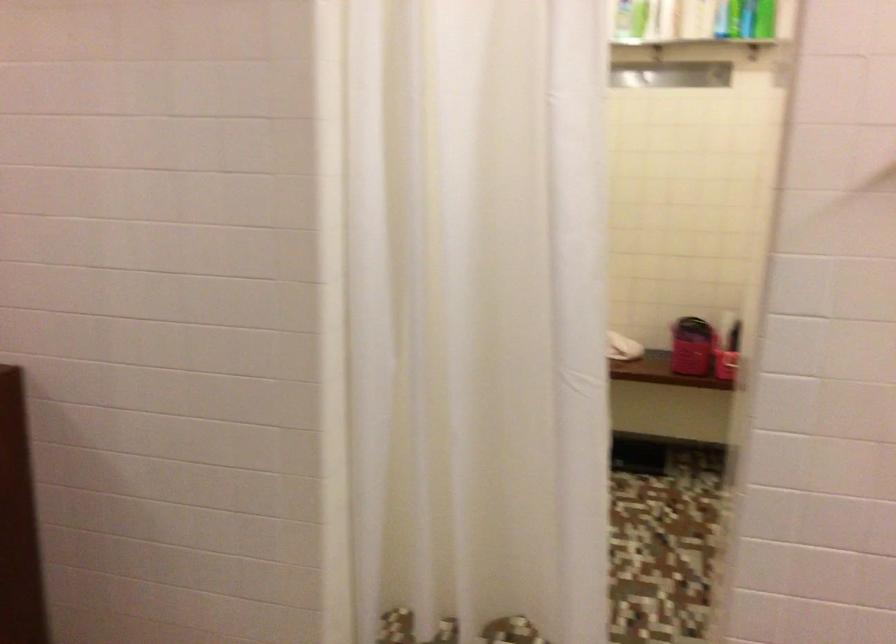
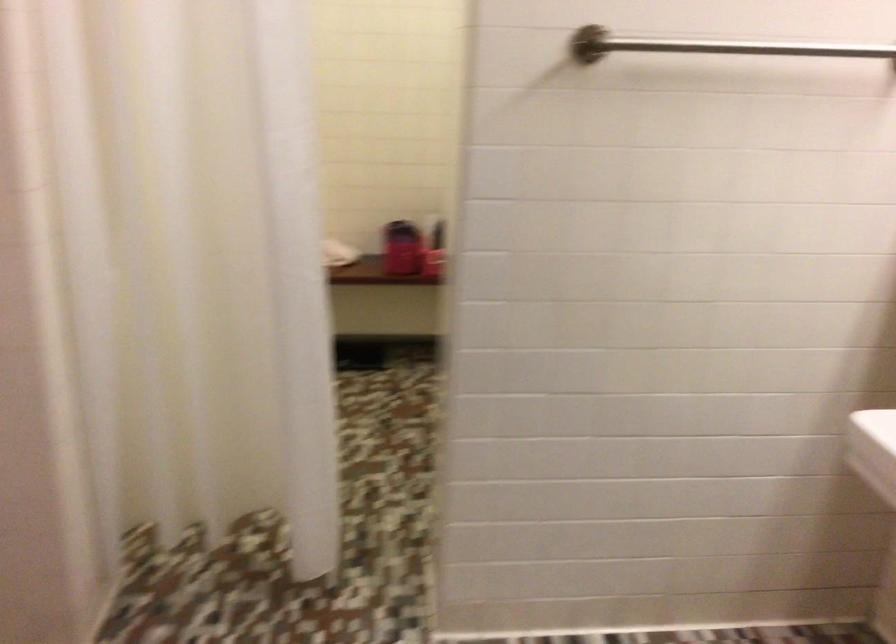
Find the pixel in the second image that matches point 666,393 in the first image.

(382, 301)